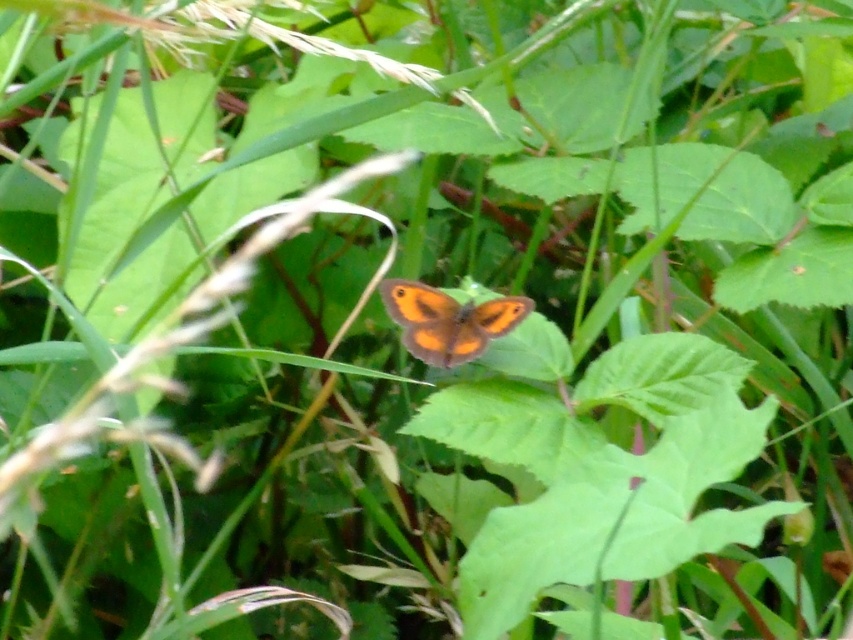
You are an entomologist observing a butterfly on two leaves in the center of the image. Which leaf, the green matte leaf at center or the green smooth leaf at center, is positioned to the left?

The green matte leaf at center is positioned to the left of the green smooth leaf at center.

You are an entomologist observing the butterfly in the scene. You notice two leaves at the center where the butterfly is resting. Which leaf, the green matte leaf at center or the green smooth leaf at center, is larger in size?

The green matte leaf at center is bigger than the green smooth leaf at center, so the green matte leaf at center is larger in size.

You are an entomologist observing the green smooth leaf at center and the orange matte butterfly at center. Which object takes up more space in the image?

The green smooth leaf at center is larger in size than the orange matte butterfly at center, so it takes up more space in the image.